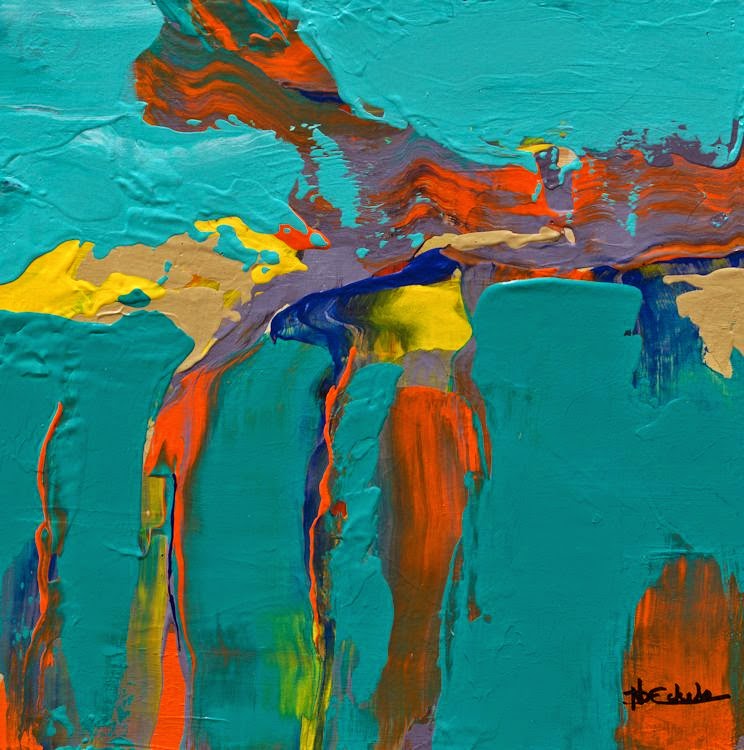
Where is `purple paint`? This screenshot has width=744, height=750. purple paint is located at coordinates (329, 272).